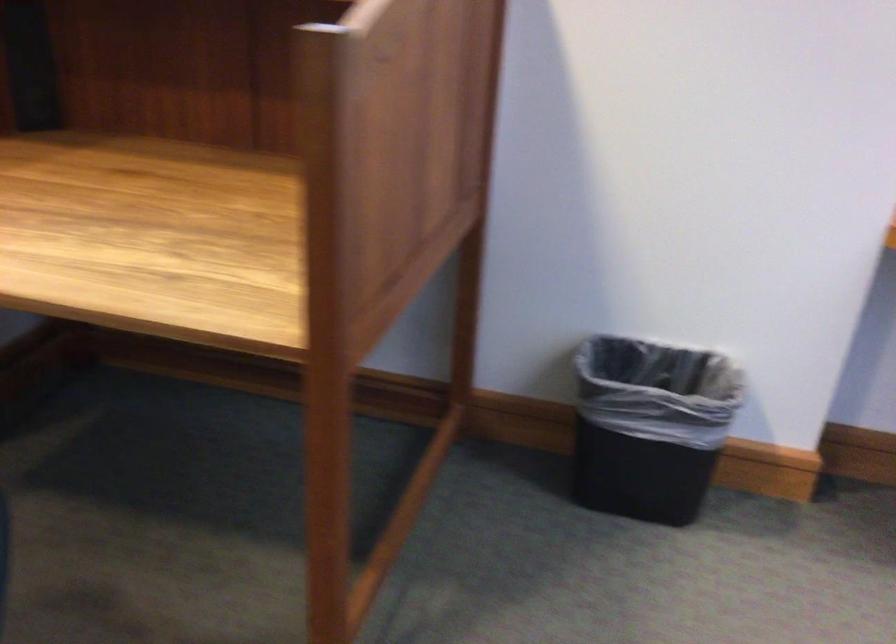
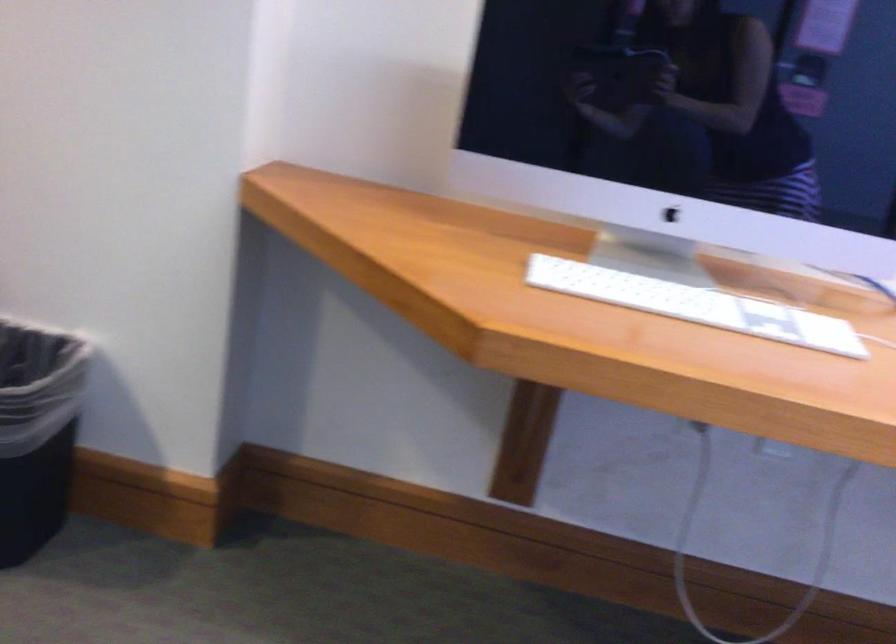
In the second image, find the point that corresponds to the point at 745,426 in the first image.

(37, 431)